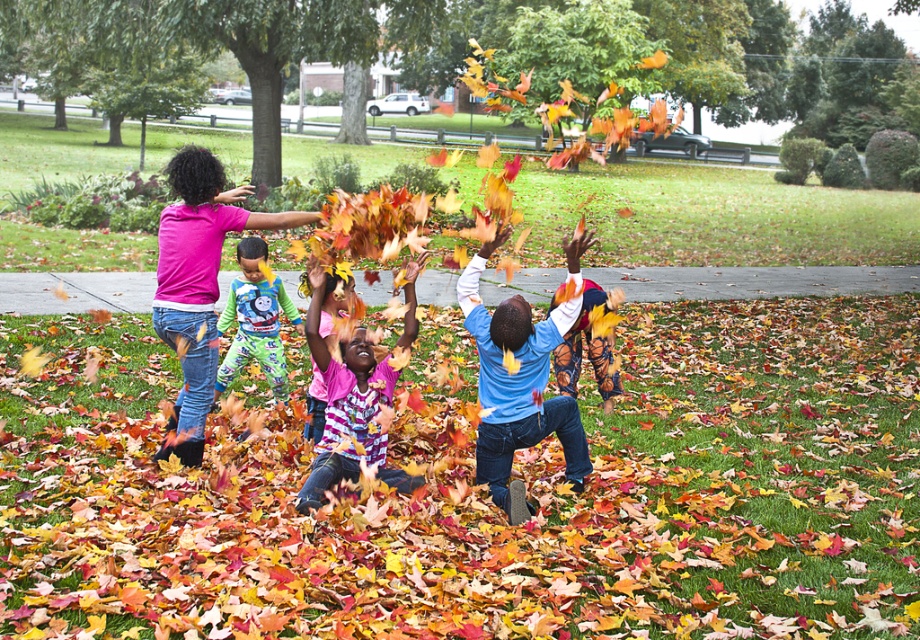
You are standing at the point with coordinates (518,387) in the park scene. What clothing item are you currently standing on?

The point with coordinates (518,387) is on the blue fleece sweatshirt at center.

You are a photographer trying to capture a photo of the blue fleece sweatshirt at center and the thomas the tank engine pajamas at center. Which one is closer to the camera?

The blue fleece sweatshirt at center is positioned under thomas the tank engine pajamas at center, so the blue fleece sweatshirt at center is closer to the camera.